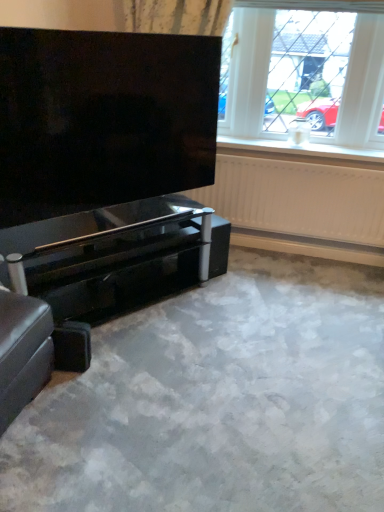
Locate an element on the screen. empty space that is ontop of white textured radiator at upper right (from a real-world perspective) is located at coordinates (292, 159).